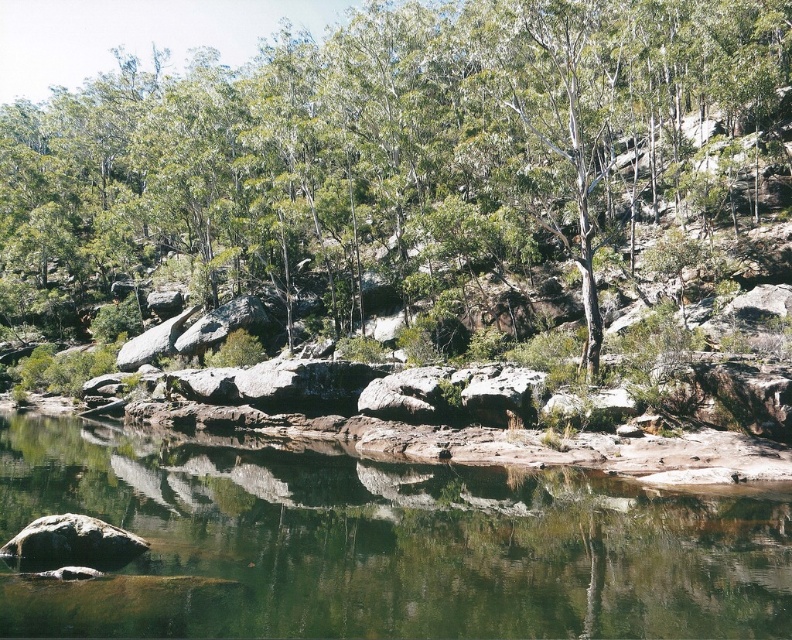
Question: Can you confirm if clear water at center is positioned above smooth gray rock at lower left?

Choices:
 (A) no
 (B) yes

Answer: (A)

Question: Which point is closer to the camera?

Choices:
 (A) smooth gray rock at lower left
 (B) green leafy tree at center
 (C) clear water at center

Answer: (C)

Question: Is clear water at center above smooth gray rock at lower left?

Choices:
 (A) yes
 (B) no

Answer: (B)

Question: Which point is closer to the camera taking this photo?

Choices:
 (A) (756, 531)
 (B) (99, 205)
 (C) (128, 560)

Answer: (C)

Question: Which object is the farthest from the green leafy tree at center?

Choices:
 (A) clear water at center
 (B) smooth gray rock at lower left

Answer: (B)

Question: Does green leafy tree at center appear under clear water at center?

Choices:
 (A) yes
 (B) no

Answer: (B)